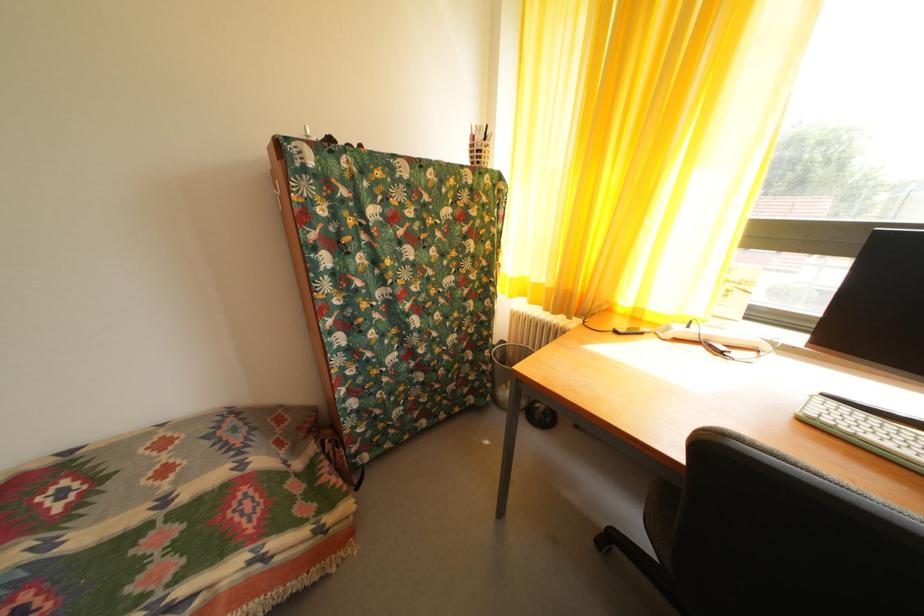
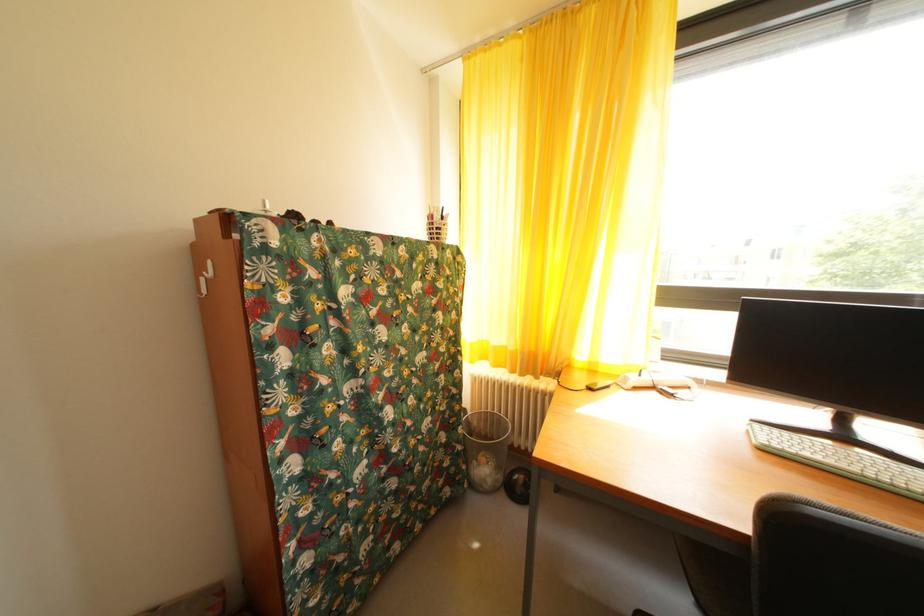
Where in the second image is the point corresponding to point 481,145 from the first image?

(440, 223)